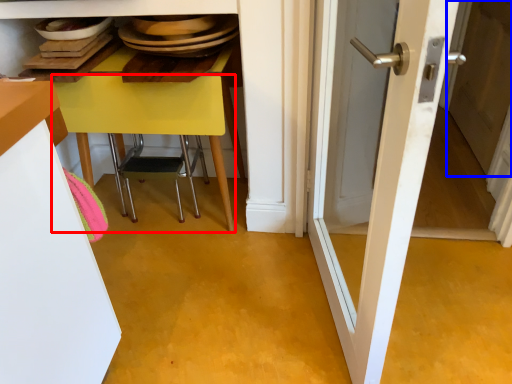
Question: Which object is further to the camera taking this photo, table (highlighted by a red box) or screen door (highlighted by a blue box)?

Choices:
 (A) table
 (B) screen door

Answer: (B)